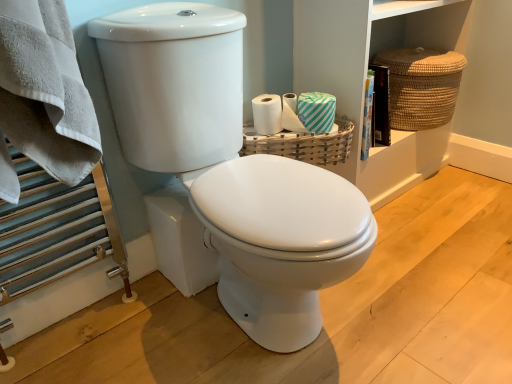
At what (x,y) coordinates should I click in order to perform the action: click on free location to the right of brown woven basket at upper right. Please return your answer as a coordinate pair (x, y). The width and height of the screenshot is (512, 384). Looking at the image, I should click on (461, 186).